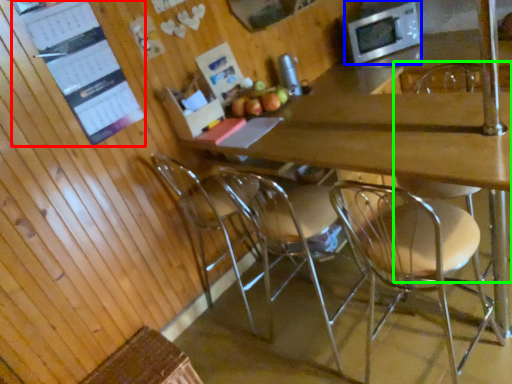
Question: Based on their relative distances, which object is nearer to bulletin board (highlighted by a red box)? Choose from microwave oven (highlighted by a blue box) and chair (highlighted by a green box).

Choices:
 (A) microwave oven
 (B) chair

Answer: (A)